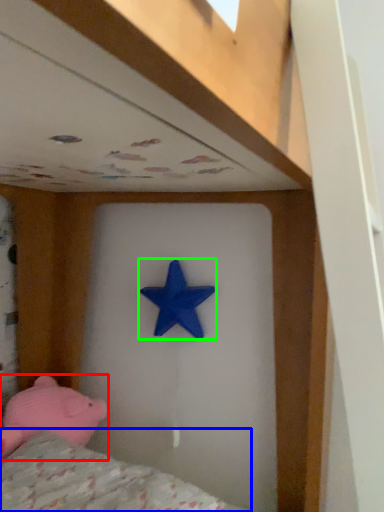
Question: Which object is positioned closest to toy (highlighted by a red box)? Select from mattress (highlighted by a blue box) and starfish (highlighted by a green box).

Choices:
 (A) mattress
 (B) starfish

Answer: (A)